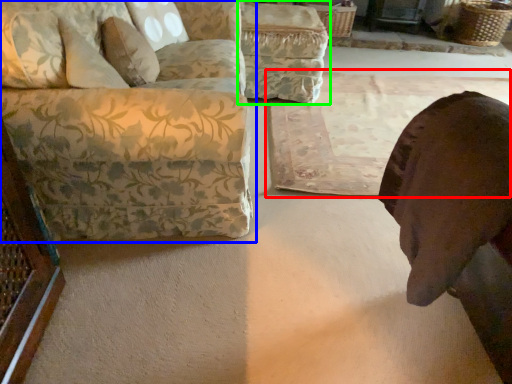
Question: Which object is positioned closest to mat (highlighted by a red box)? Select from studio couch (highlighted by a blue box) and swivel chair (highlighted by a green box).

Choices:
 (A) studio couch
 (B) swivel chair

Answer: (B)